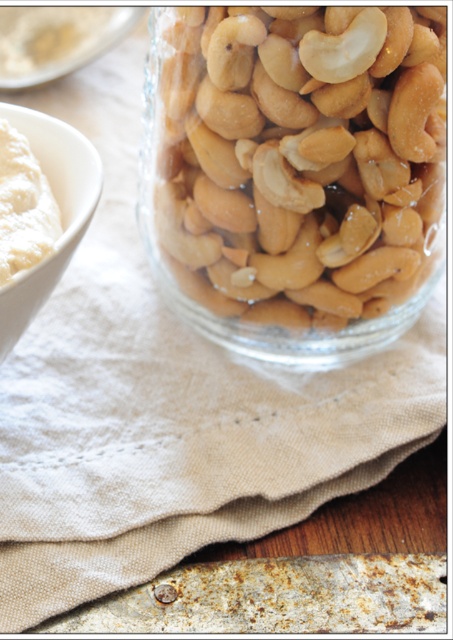
You are arranging snacks on a table and need to place both the white matte bowl at left and the white creamy spread at left. Since they are both white, you want to ensure they are distinguishable. Based on their positions, which one is closer to you?

The white matte bowl at left is closer to you because it is in front of the white creamy spread at left.

Consider the image. You are a chef preparing a dish and need to know the height of the shiny beige cashews at center and the white creamy spread at left. Which one is taller?

The shiny beige cashews at center is taller than the white creamy spread at left.